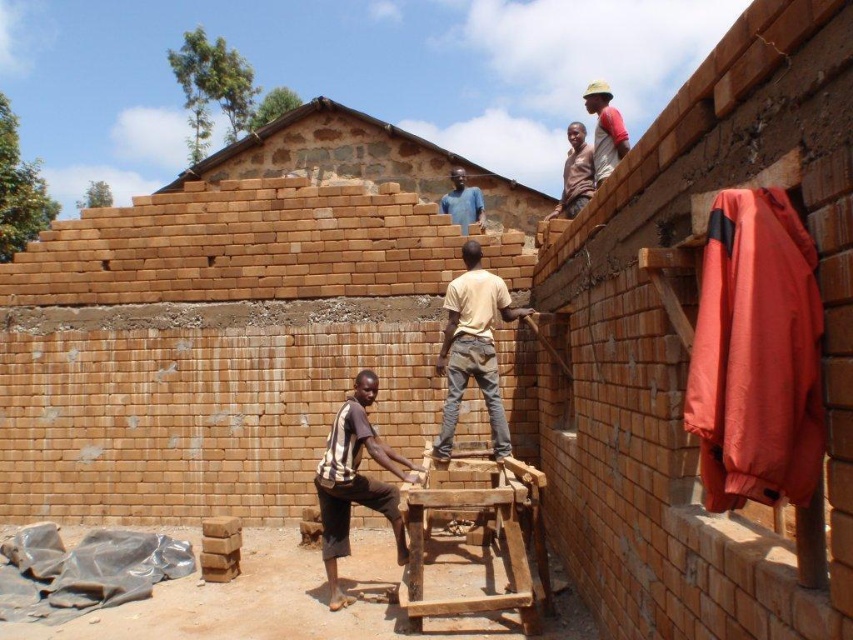
Question: Which point is closer to the camera?

Choices:
 (A) brown striped shirt at lower center
 (B) tan cotton shirt at center
 (C) light brown wooden pole at upper center

Answer: (A)

Question: Considering the relative positions of tan cotton shirt at center and blue matte shirt at upper center in the image provided, where is tan cotton shirt at center located with respect to blue matte shirt at upper center?

Choices:
 (A) below
 (B) above

Answer: (A)

Question: Does matte brown shirt at upper center have a lesser width compared to blue matte shirt at upper center?

Choices:
 (A) no
 (B) yes

Answer: (A)

Question: Which of these objects is positioned closest to the brown striped shirt at lower center?

Choices:
 (A) matte brown shirt at upper center
 (B) tan cotton shirt at center
 (C) blue matte shirt at upper center
 (D) light brown wooden pole at upper center

Answer: (B)

Question: Which of the following is the farthest from the observer?

Choices:
 (A) (381, 486)
 (B) (572, 136)
 (C) (482, 209)

Answer: (C)

Question: Where is light brown wooden pole at upper center located in relation to matte brown shirt at upper center in the image?

Choices:
 (A) below
 (B) above

Answer: (B)